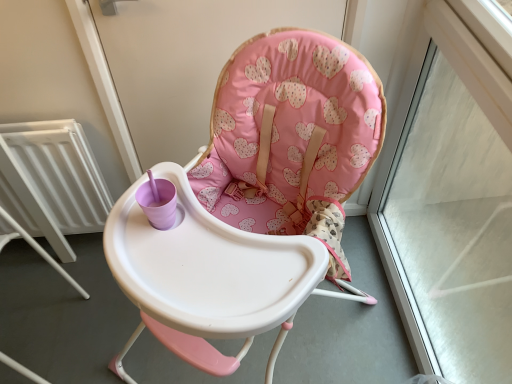
Question: From a real-world perspective, is transparent glass window frame at upper right on top of pink fabric screen door at upper center?

Choices:
 (A) yes
 (B) no

Answer: (B)

Question: Is transparent glass window frame at upper right oriented away from pink fabric screen door at upper center?

Choices:
 (A) no
 (B) yes

Answer: (A)

Question: Is transparent glass window frame at upper right not within pink fabric screen door at upper center?

Choices:
 (A) no
 (B) yes

Answer: (B)

Question: Considering the relative positions of transparent glass window frame at upper right and pink fabric screen door at upper center in the image provided, is transparent glass window frame at upper right behind pink fabric screen door at upper center?

Choices:
 (A) yes
 (B) no

Answer: (B)

Question: Is transparent glass window frame at upper right taller than pink fabric screen door at upper center?

Choices:
 (A) yes
 (B) no

Answer: (A)

Question: From the image's perspective, is transparent glass window frame at upper right located above or below white metallic radiator at left?

Choices:
 (A) below
 (B) above

Answer: (A)

Question: In the image, is transparent glass window frame at upper right on the left side or the right side of white metallic radiator at left?

Choices:
 (A) left
 (B) right

Answer: (B)

Question: Is point (484, 112) positioned closer to the camera than point (20, 153)?

Choices:
 (A) farther
 (B) closer

Answer: (B)

Question: Relative to white metallic radiator at left, is transparent glass window frame at upper right in front or behind?

Choices:
 (A) behind
 (B) front

Answer: (B)

Question: In the image, is transparent glass window frame at upper right positioned in front of or behind pink fabric screen door at upper center?

Choices:
 (A) front
 (B) behind

Answer: (A)

Question: From the image's perspective, is transparent glass window frame at upper right above or below pink fabric screen door at upper center?

Choices:
 (A) below
 (B) above

Answer: (A)

Question: Considering the positions of transparent glass window frame at upper right and pink fabric screen door at upper center in the image, is transparent glass window frame at upper right wider or thinner than pink fabric screen door at upper center?

Choices:
 (A) wide
 (B) thin

Answer: (A)

Question: Considering the positions of point [x=458, y=97] and point [x=231, y=49], is point [x=458, y=97] closer or farther from the camera than point [x=231, y=49]?

Choices:
 (A) farther
 (B) closer

Answer: (A)

Question: Is pink fabric highchair at center bigger or smaller than transparent glass window frame at upper right?

Choices:
 (A) small
 (B) big

Answer: (B)

Question: Is pink fabric highchair at center inside or outside of transparent glass window frame at upper right?

Choices:
 (A) outside
 (B) inside

Answer: (A)